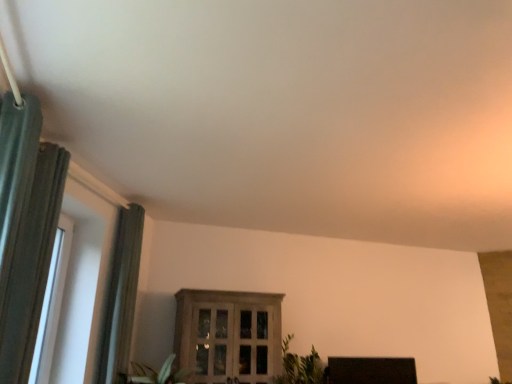
Question: Does wooden cabinet at center, which appears as the 2th window when viewed from the front, have a lesser width compared to black matte tv at lower right?

Choices:
 (A) yes
 (B) no

Answer: (B)

Question: Is wooden cabinet at center, which appears as the first window when viewed from the back, oriented away from black matte tv at lower right?

Choices:
 (A) yes
 (B) no

Answer: (B)

Question: From the image's perspective, is wooden cabinet at center, which appears as the 2th window when viewed from the front, on top of black matte tv at lower right?

Choices:
 (A) no
 (B) yes

Answer: (B)

Question: From a real-world perspective, is wooden cabinet at center, placed as the 1th window when sorted from right to left, below black matte tv at lower right?

Choices:
 (A) yes
 (B) no

Answer: (B)

Question: Does wooden cabinet at center, which appears as the 2th window when viewed from the front, have a lesser height compared to black matte tv at lower right?

Choices:
 (A) yes
 (B) no

Answer: (B)

Question: Is point (25, 120) closer or farther from the camera than point (53, 271)?

Choices:
 (A) closer
 (B) farther

Answer: (A)

Question: Considering the positions of green fabric curtain at left, placed as the first curtain when sorted from front to back, and white plastic window at left, which ranks as the first window in left-to-right order, in the image, is green fabric curtain at left, placed as the first curtain when sorted from front to back, wider or thinner than white plastic window at left, which ranks as the first window in left-to-right order,?

Choices:
 (A) thin
 (B) wide

Answer: (B)

Question: Is green fabric curtain at left, placed as the first curtain when sorted from front to back, taller or shorter than white plastic window at left, the second window viewed from the back?

Choices:
 (A) short
 (B) tall

Answer: (B)

Question: Considering the positions of green fabric curtain at left, placed as the first curtain when sorted from front to back, and white plastic window at left, which is counted as the second window, starting from the right, in the image, is green fabric curtain at left, placed as the first curtain when sorted from front to back, bigger or smaller than white plastic window at left, which is counted as the second window, starting from the right,?

Choices:
 (A) small
 (B) big

Answer: (B)

Question: Considering the positions of point (60, 269) and point (100, 380), is point (60, 269) closer or farther from the camera than point (100, 380)?

Choices:
 (A) farther
 (B) closer

Answer: (A)

Question: From the image's perspective, relative to green textured curtain at left, acting as the 2th curtain starting from the front, is white plastic window at left, which is counted as the second window, starting from the right, above or below?

Choices:
 (A) above
 (B) below

Answer: (A)

Question: Is white plastic window at left, the second window viewed from the back, in front of or behind green textured curtain at left, acting as the 2th curtain starting from the front, in the image?

Choices:
 (A) behind
 (B) front

Answer: (B)

Question: From a real-world perspective, is white plastic window at left, the second window viewed from the back, physically located above or below green textured curtain at left, acting as the 2th curtain starting from the front?

Choices:
 (A) above
 (B) below

Answer: (B)

Question: Considering their positions, is green textured curtain at left, acting as the 2th curtain starting from the front, located in front of or behind green leafy plant at lower center?

Choices:
 (A) behind
 (B) front

Answer: (B)

Question: Would you say green textured curtain at left, positioned as the first curtain in back-to-front order, is to the left or to the right of green leafy plant at lower center in the picture?

Choices:
 (A) right
 (B) left

Answer: (B)